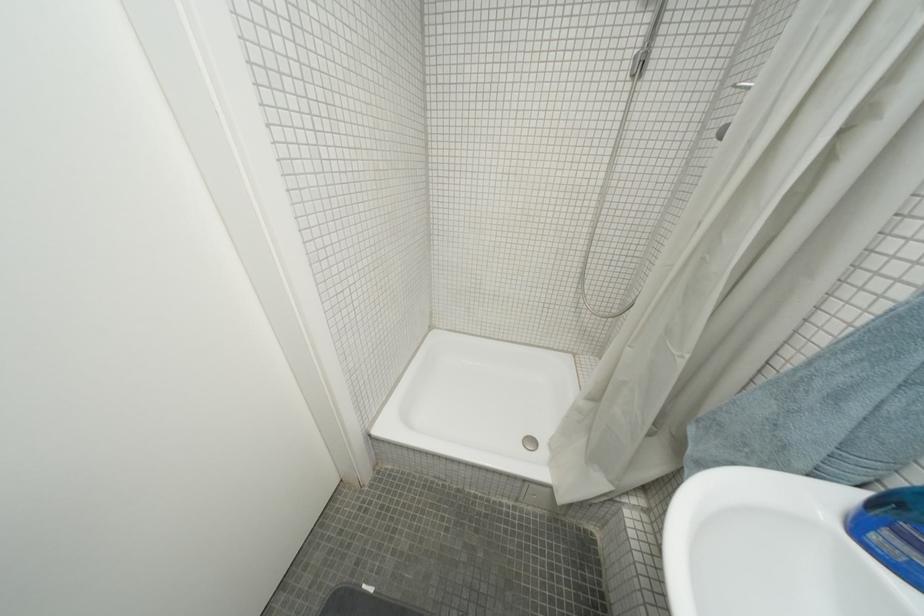
I want to click on white shower curtain, so click(x=757, y=238).